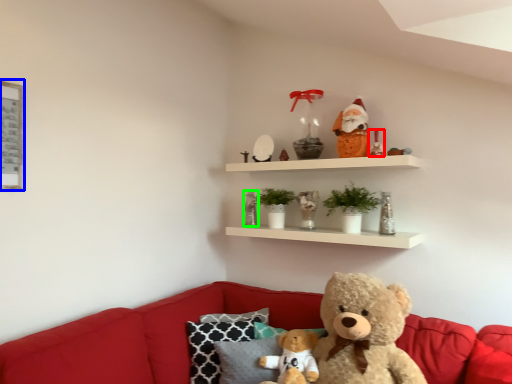
Question: Considering the real-world distances, which object is farthest from toy (highlighted by a red box)? picture frame (highlighted by a blue box) or toy (highlighted by a green box)?

Choices:
 (A) picture frame
 (B) toy

Answer: (A)